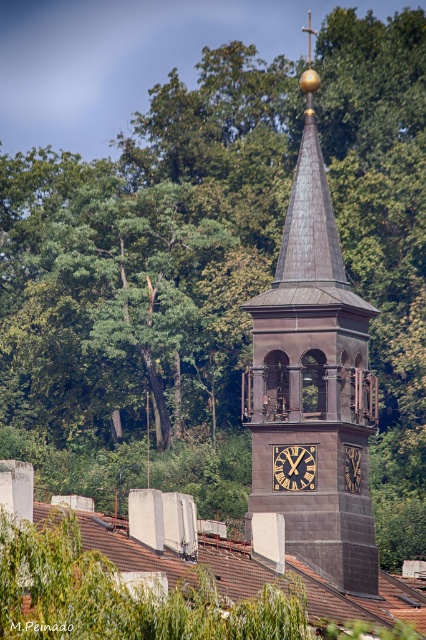
Question: Can you confirm if dark gray stone clock tower at center is smaller than gold metallic clock at center?

Choices:
 (A) no
 (B) yes

Answer: (A)

Question: Which object appears closest to the camera in this image?

Choices:
 (A) gold metallic clock at center
 (B) dark gray stone clock tower at center
 (C) gold/black clock at center

Answer: (B)

Question: Which point is farther to the camera?

Choices:
 (A) (354, 476)
 (B) (334, 529)
 (C) (281, 456)

Answer: (A)

Question: Is gold metallic clock at center wider than gold/black clock at center?

Choices:
 (A) yes
 (B) no

Answer: (A)

Question: Which point is farther to the camera?

Choices:
 (A) dark gray stone clock tower at center
 (B) gold metallic clock at center

Answer: (B)

Question: From the image, what is the correct spatial relationship of gold metallic clock at center in relation to gold/black clock at center?

Choices:
 (A) left
 (B) right

Answer: (A)